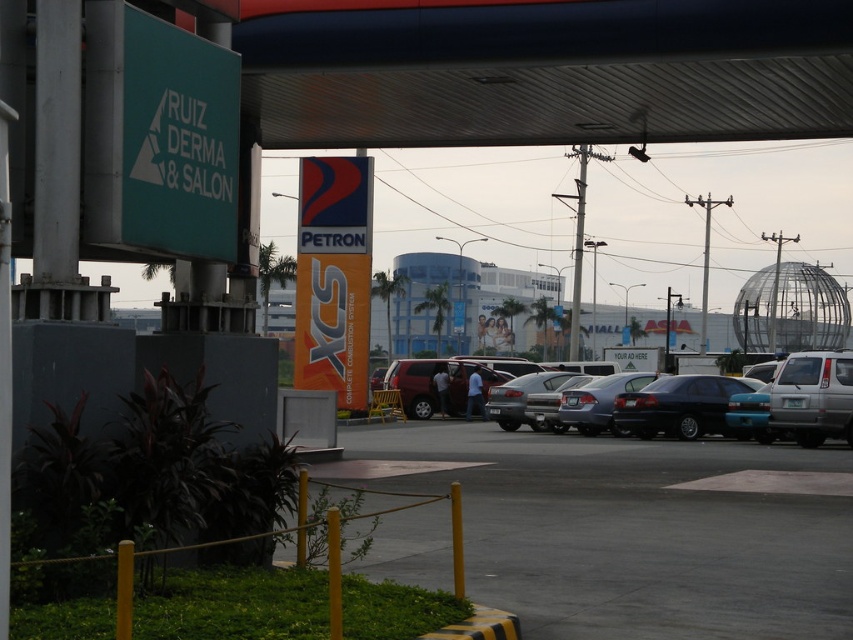
Question: Does matte black sedan at center have a smaller size compared to dark blue sedan at center?

Choices:
 (A) yes
 (B) no

Answer: (B)

Question: Can you confirm if matte black sedan at center is wider than dark blue sedan at center?

Choices:
 (A) yes
 (B) no

Answer: (A)

Question: Which of these objects is positioned closest to the dark blue sedan at center?

Choices:
 (A) smooth asphalt parking lot at lower center
 (B) matte black sedan at center

Answer: (B)

Question: Estimate the real-world distances between objects in this image. Which object is farther from the dark blue sedan at center?

Choices:
 (A) smooth asphalt parking lot at lower center
 (B) matte black sedan at center

Answer: (A)

Question: Among these points, which one is farthest from the camera?

Choices:
 (A) (337, 477)
 (B) (735, 429)

Answer: (B)

Question: Does smooth asphalt parking lot at lower center have a larger size compared to matte black sedan at center?

Choices:
 (A) yes
 (B) no

Answer: (B)